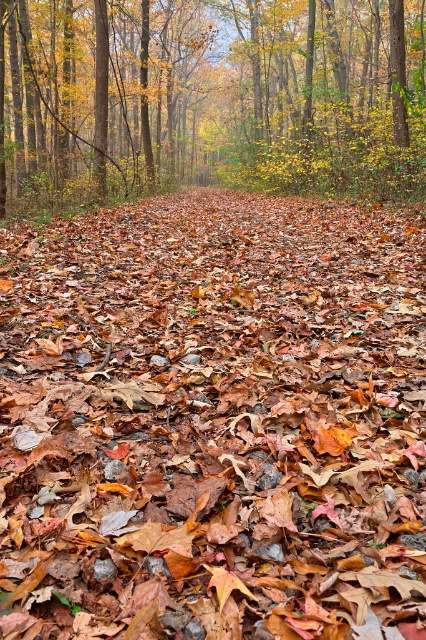
You are standing at the starting point of the path in the autumn forest scene. You want to walk to the end of the path, which is hidden in the shadows. To avoid stepping on the brown leaf litter at center, where should you place your foot?

To avoid stepping on the brown leaf litter at center, you should place your foot anywhere except the coordinates specified at point (213, 420).